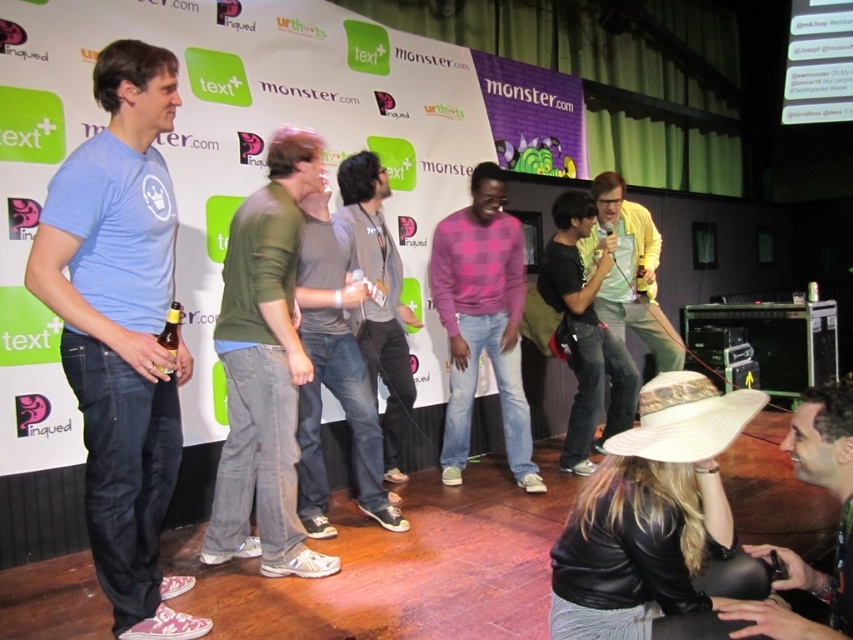
Can you confirm if leather jacket at lower right is positioned above gray cotton shirt at center?

Incorrect, leather jacket at lower right is not positioned above gray cotton shirt at center.

Between point (796, 566) and point (366, 340), which one is positioned in front?

Point (796, 566)

Where is `leather jacket at lower right`? The width and height of the screenshot is (853, 640). leather jacket at lower right is located at coordinates (838, 524).

Does point (103, 420) lie behind point (601, 237)?

No, it is in front of (601, 237).

Who is more distant from viewer, (84, 180) or (665, 324)?

Positioned behind is point (665, 324).

In order to click on light blue t-shirt at left in this screenshot , I will do `click(120, 330)`.

From the picture: Does pink checkered sweater at center appear over gray cotton shirt at center?

Incorrect, pink checkered sweater at center is not positioned above gray cotton shirt at center.

Locate an element on the screen. pink checkered sweater at center is located at coordinates [x=482, y=321].

Image resolution: width=853 pixels, height=640 pixels. In order to click on pink checkered sweater at center in this screenshot , I will do `click(482, 321)`.